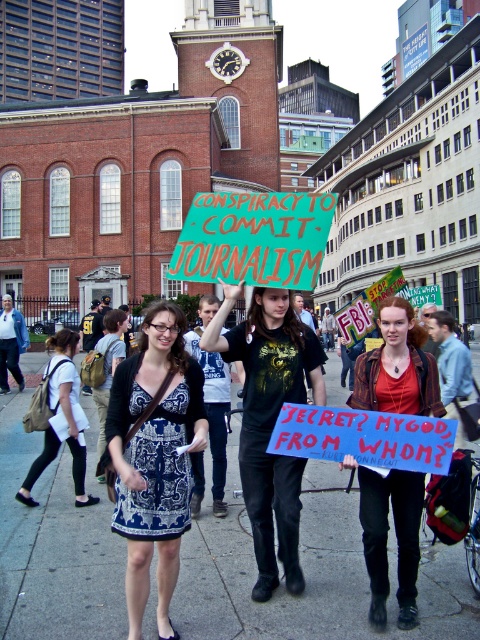
Can you confirm if blue printed dress at center is positioned below black t-shirt at center?

Yes.

Is blue printed dress at center bigger than black t-shirt at center?

Indeed, blue printed dress at center has a larger size compared to black t-shirt at center.

Find the location of a particular element. The image size is (480, 640). blue printed dress at center is located at coordinates (155, 458).

Can you confirm if black t-shirt at center is smaller than green fabric sign at center?

Indeed, black t-shirt at center has a smaller size compared to green fabric sign at center.

Is point (216, 314) positioned behind point (213, 193)?

Yes, it is behind point (213, 193).

Is point (278, 323) closer to camera compared to point (236, 240)?

No, it is not.

Where is `black t-shirt at center`? This screenshot has height=640, width=480. black t-shirt at center is located at coordinates (269, 420).

Where is `gray concrete pavement at center`? gray concrete pavement at center is located at coordinates (309, 572).

Who is more distant from viewer, (x=76, y=579) or (x=251, y=420)?

Point (x=251, y=420)

The width and height of the screenshot is (480, 640). I want to click on gray concrete pavement at center, so click(309, 572).